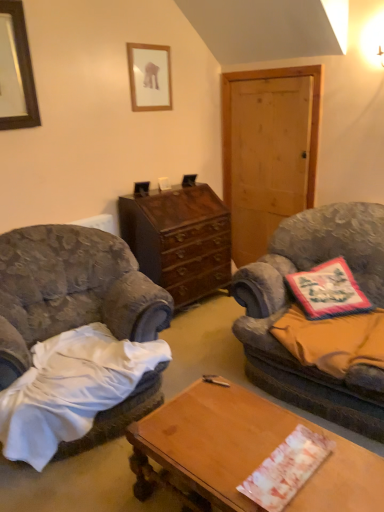
Question: From the image's perspective, does white paper at center, acting as the first sheet starting from the bottom, appear lower than dark brown wood cabinet at center?

Choices:
 (A) no
 (B) yes

Answer: (B)

Question: From a real-world perspective, is white paper at center, the 2th sheet from the top, below dark brown wood cabinet at center?

Choices:
 (A) yes
 (B) no

Answer: (A)

Question: Is the position of white paper at center, acting as the first sheet starting from the bottom, more distant than that of dark brown wood cabinet at center?

Choices:
 (A) yes
 (B) no

Answer: (B)

Question: Considering the relative sizes of white paper at center, the 2th sheet from the top, and dark brown wood cabinet at center in the image provided, is white paper at center, the 2th sheet from the top, smaller than dark brown wood cabinet at center?

Choices:
 (A) no
 (B) yes

Answer: (B)

Question: Is white paper at center, acting as the first sheet starting from the bottom, positioned in front of dark brown wood cabinet at center?

Choices:
 (A) yes
 (B) no

Answer: (A)

Question: From the image's perspective, is white paper at center, marked as the second sheet in a back-to-front arrangement, on dark brown wood cabinet at center?

Choices:
 (A) yes
 (B) no

Answer: (B)

Question: Can you see black wooden picture frame at upper left, which is the second picture frame in back-to-front order, touching velvet fabric couch at right?

Choices:
 (A) yes
 (B) no

Answer: (B)

Question: From a real-world perspective, is black wooden picture frame at upper left, arranged as the 2th picture frame when viewed from the right, beneath velvet fabric couch at right?

Choices:
 (A) yes
 (B) no

Answer: (B)

Question: Is the depth of black wooden picture frame at upper left, which is the second picture frame in back-to-front order, greater than that of velvet fabric couch at right?

Choices:
 (A) no
 (B) yes

Answer: (B)

Question: Does black wooden picture frame at upper left, the first picture frame positioned from the front, have a lesser height compared to velvet fabric couch at right?

Choices:
 (A) yes
 (B) no

Answer: (A)

Question: Can you confirm if black wooden picture frame at upper left, the first picture frame positioned from the left, is thinner than velvet fabric couch at right?

Choices:
 (A) no
 (B) yes

Answer: (B)

Question: Does black wooden picture frame at upper left, which is the second picture frame in back-to-front order, have a larger size compared to velvet fabric couch at right?

Choices:
 (A) yes
 (B) no

Answer: (B)

Question: Is white paper at center, the 1th sheet viewed from the front, to the left of velvet gray armchair at left from the viewer's perspective?

Choices:
 (A) no
 (B) yes

Answer: (A)